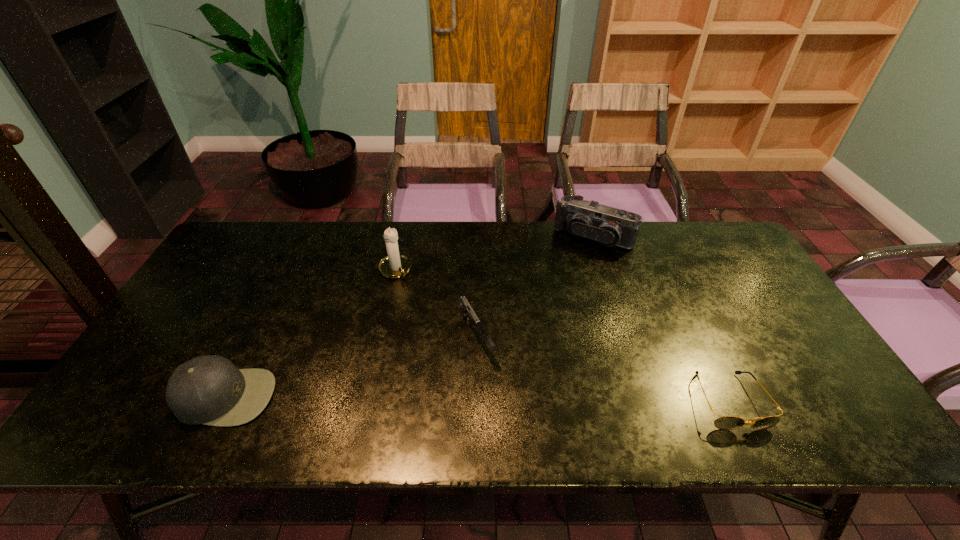
Where is `object present at the left edge`? The image size is (960, 540). object present at the left edge is located at coordinates (208, 389).

At what (x,y) coordinates should I click in order to perform the action: click on object that is at the near left corner. Please return your answer as a coordinate pair (x, y). Looking at the image, I should click on (208, 389).

You are a GUI agent. You are given a task and a screenshot of the screen. Output one action in this format:
    pyautogui.click(x=<x>, y=<y>)
    Task: Click on the vacant space at the far edge of the desktop
    
    Given the screenshot: What is the action you would take?
    pyautogui.click(x=581, y=258)

Image resolution: width=960 pixels, height=540 pixels. In order to click on free point at the near edge in this screenshot , I will do `click(610, 395)`.

In the image, there is a desktop. Find the location of `vacant space at the left edge`. vacant space at the left edge is located at coordinates (153, 368).

Locate an element on the screen. free space at the right edge of the desktop is located at coordinates (720, 295).

Identify the location of vacant space at the far left corner of the desktop. (243, 264).

Locate an element on the screen. The image size is (960, 540). vacant space that's between the third farthest object and the farthest object is located at coordinates (535, 287).

Find the location of a particular element. The image size is (960, 540). free space between the second object from left to right and the second tallest object is located at coordinates (493, 253).

Where is `vacant space that is in between the farthest object and the candle holder`? vacant space that is in between the farthest object and the candle holder is located at coordinates (493, 253).